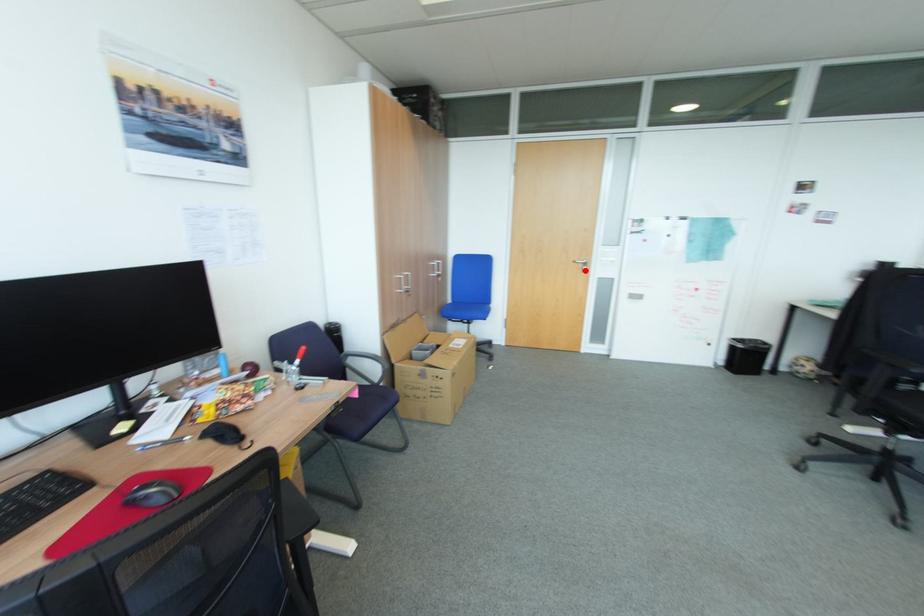
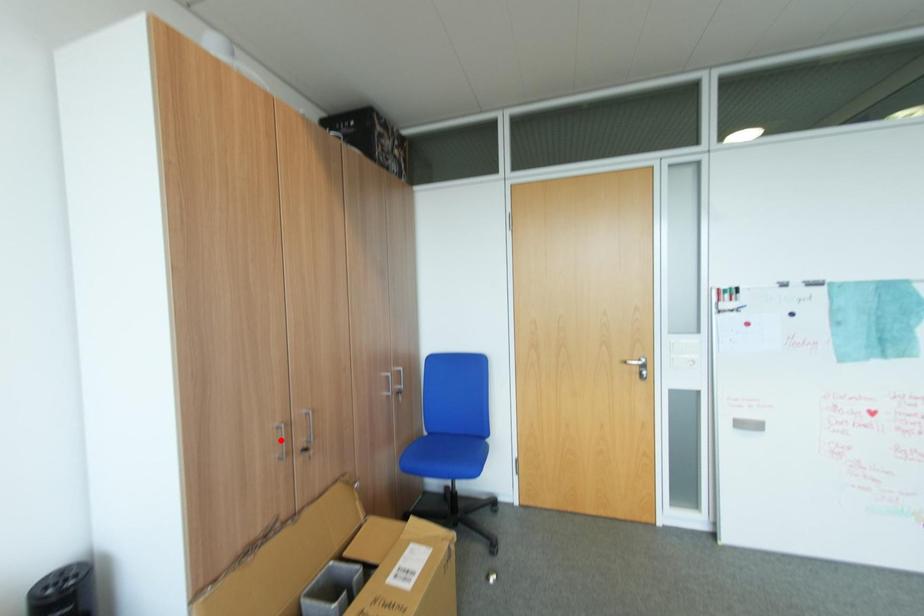
I am providing you with two images of the same scene from different viewpoints. A red point is marked on the first image and another point is marked on the second image. Are the points marked in image1 and image2 representing the same 3D position?

No